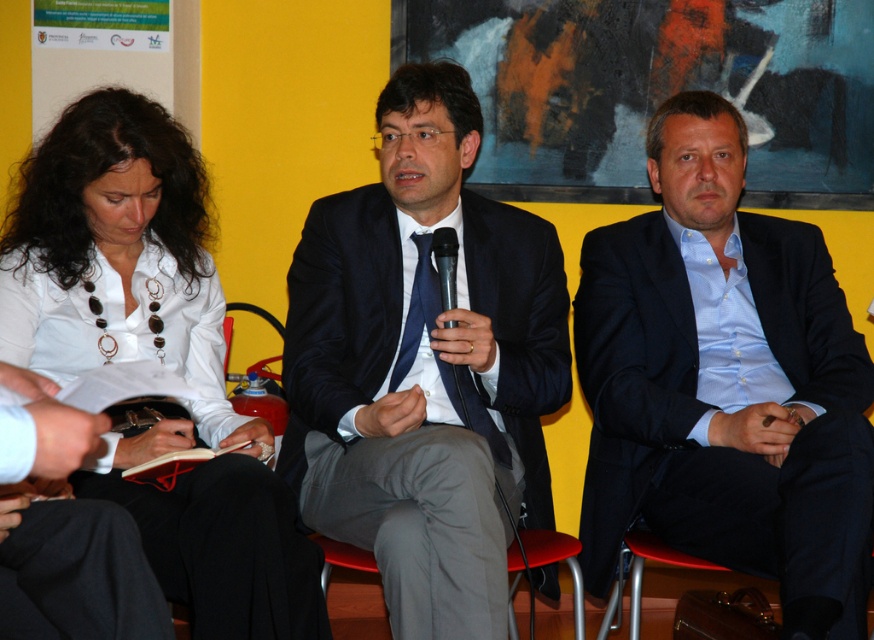
Does blue satin suit at center lie behind black plastic microphone at center?

No.

Does blue satin suit at center have a greater width compared to black plastic microphone at center?

Correct, the width of blue satin suit at center exceeds that of black plastic microphone at center.

Is point (862, 586) in front of point (449, 323)?

Yes, it is.

At what (x,y) coordinates should I click in order to perform the action: click on blue satin suit at center. Please return your answer as a coordinate pair (x, y). The width and height of the screenshot is (874, 640). Looking at the image, I should click on (725, 381).

Is point (335, 326) in front of point (444, 253)?

No, (335, 326) is behind (444, 253).

Does matte black suit at center appear under black plastic microphone at center?

Correct, matte black suit at center is located below black plastic microphone at center.

Between point (415, 244) and point (455, 237), which one is positioned in front?

Point (455, 237)

Find the location of `matte black suit at center`. matte black suit at center is located at coordinates (424, 365).

Is matte black suit at center positioned before white glossy shirt at upper left?

Yes, matte black suit at center is closer to the viewer.

Which is in front, point (486, 468) or point (309, 608)?

Positioned in front is point (486, 468).

Locate an element on the screen. The image size is (874, 640). matte black suit at center is located at coordinates (424, 365).